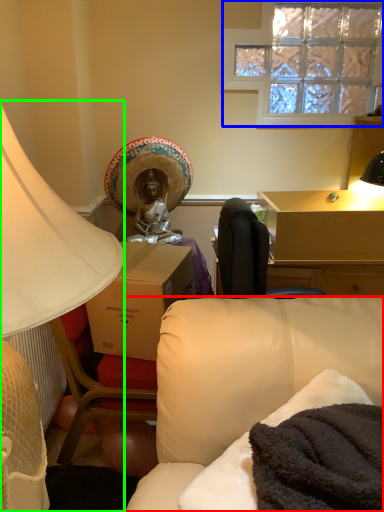
Question: Which object is positioned farthest from studio couch (highlighted by a red box)? Select from window (highlighted by a blue box) and lamp (highlighted by a green box).

Choices:
 (A) window
 (B) lamp

Answer: (A)